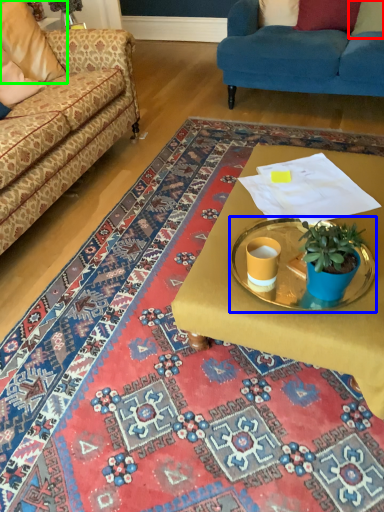
Question: Which object is positioned farthest from pillow (highlighted by a red box)? Select from round table (highlighted by a blue box) and pillow (highlighted by a green box).

Choices:
 (A) round table
 (B) pillow

Answer: (A)